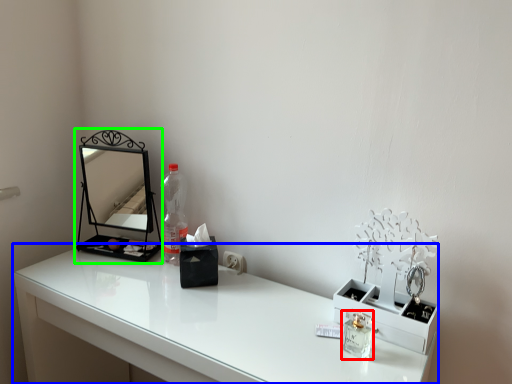
Question: Based on their relative distances, which object is farther from perfume (highlighted by a red box)? Choose from table (highlighted by a blue box) and medicine cabinet (highlighted by a green box).

Choices:
 (A) table
 (B) medicine cabinet

Answer: (B)